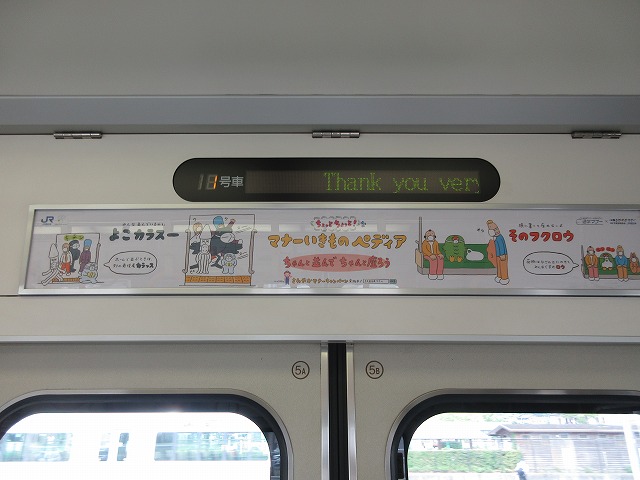
You are a GUI agent. You are given a task and a screenshot of the screen. Output one action in this format:
    pyautogui.click(x=<x>, y=<y>)
    Task: Click on the window
    
    Given the screenshot: What is the action you would take?
    pos(136,435)